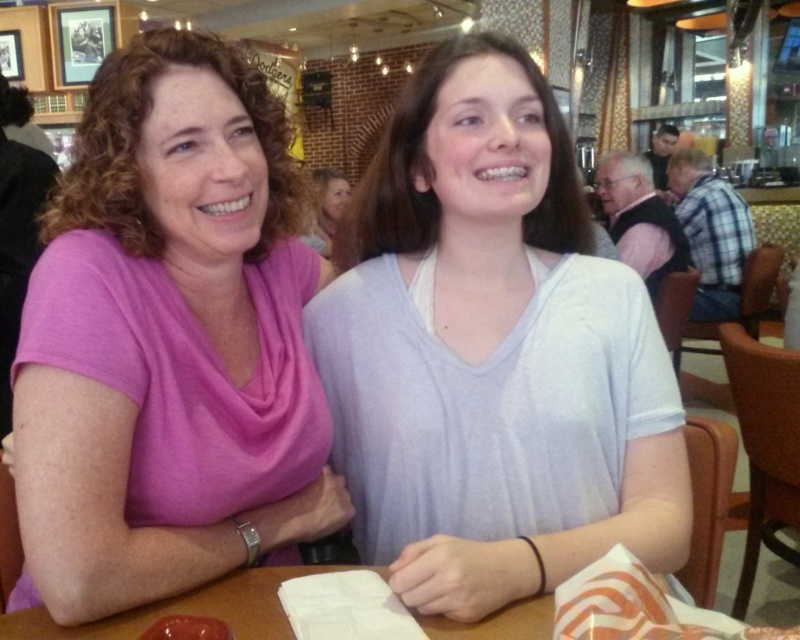
From the picture: Which of these two, blonde hair at upper center or matte red apple at lower left, stands taller?

With more height is blonde hair at upper center.

Who is positioned more to the left, blonde hair at upper center or matte red apple at lower left?

Positioned to the left is blonde hair at upper center.

Is point (320, 243) less distant than point (154, 634)?

No, it is not.

Where is `blonde hair at upper center`? This screenshot has height=640, width=800. blonde hair at upper center is located at coordinates (326, 208).

Which of these two, pink soft fabric shirt at left or blonde hair at upper center, stands taller?

pink soft fabric shirt at left

Is point (204, 248) behind point (318, 211)?

No, it is in front of (318, 211).

Image resolution: width=800 pixels, height=640 pixels. Identify the location of pink soft fabric shirt at left. (174, 342).

Is point (296, 566) less distant than point (200, 627)?

No, (296, 566) is behind (200, 627).

Is point (30, 618) more distant than point (192, 637)?

Yes, it is behind point (192, 637).

I want to click on wooden table at center, so click(x=182, y=611).

Find the location of `wooden table at center`. wooden table at center is located at coordinates (182, 611).